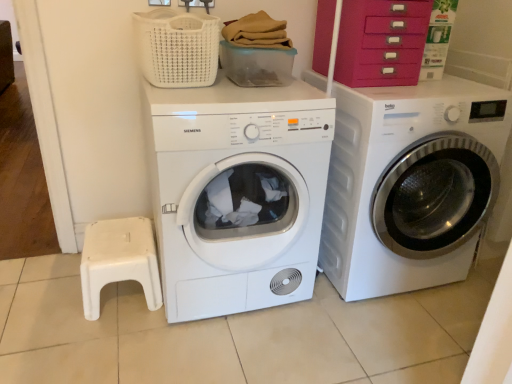
Identify the location of vacant area located to the right-hand side of velvet pink drawer at upper right. This screenshot has width=512, height=384. (451, 90).